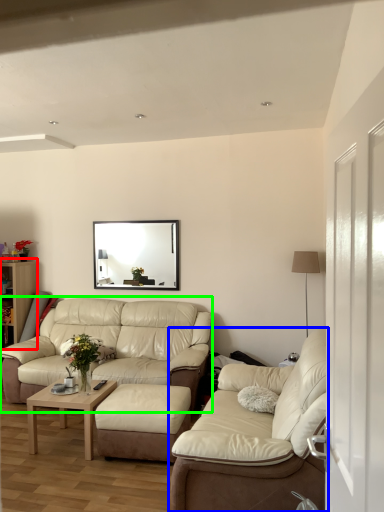
Question: Based on their relative distances, which object is farther from dresser (highlighted by a red box)? Choose from studio couch (highlighted by a blue box) and studio couch (highlighted by a green box).

Choices:
 (A) studio couch
 (B) studio couch

Answer: (A)